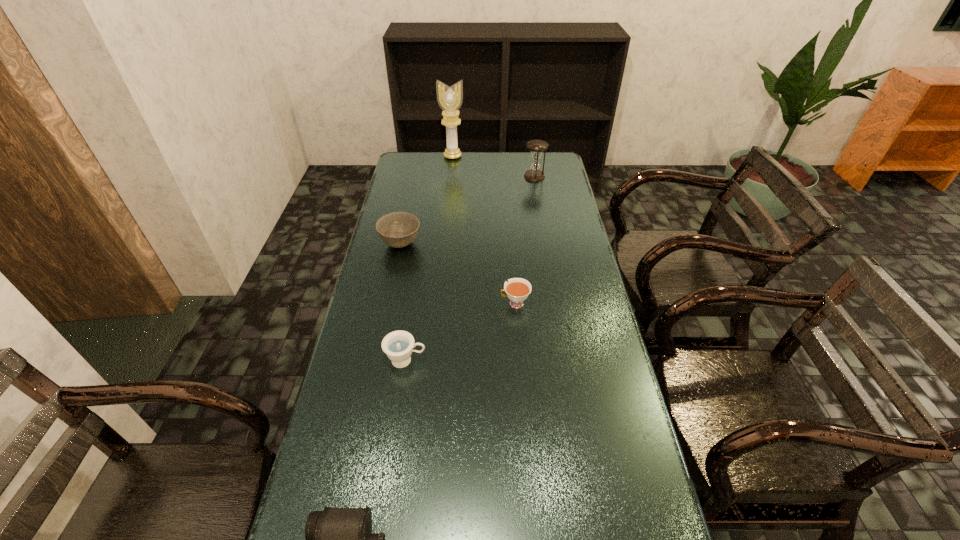
Locate which object is the fourth closest to the rightmost object. Please provide its 2D coordinates. Your answer should be formatted as a tuple, i.e. [(x, y)], where the tuple contains the x and y coordinates of a point satisfying the conditions above.

[(398, 345)]

Where is `vacant space that satisfies the following two spatial constraints: 1. on the front side of the rightmost object; 2. on the side of the third nearest object with the handle`? vacant space that satisfies the following two spatial constraints: 1. on the front side of the rightmost object; 2. on the side of the third nearest object with the handle is located at coordinates (557, 303).